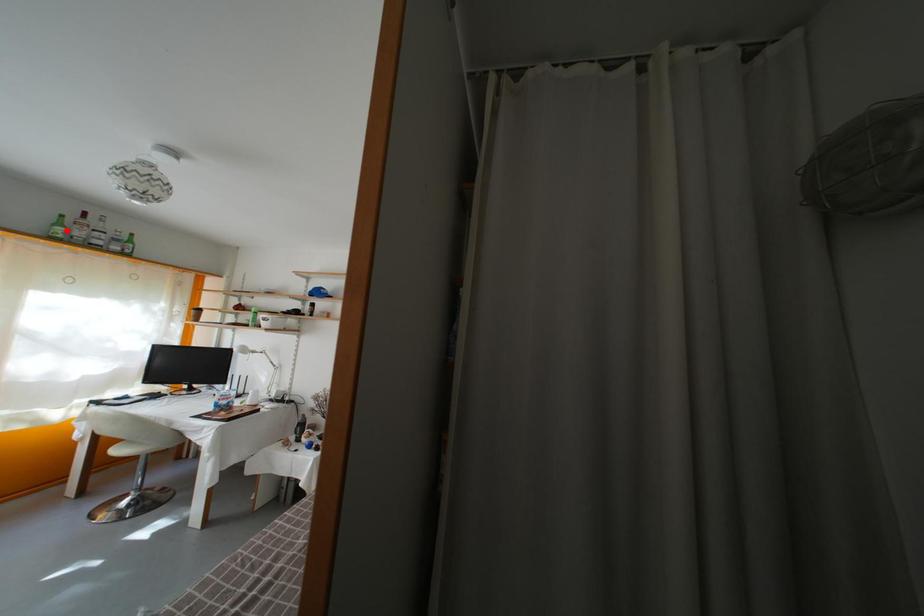
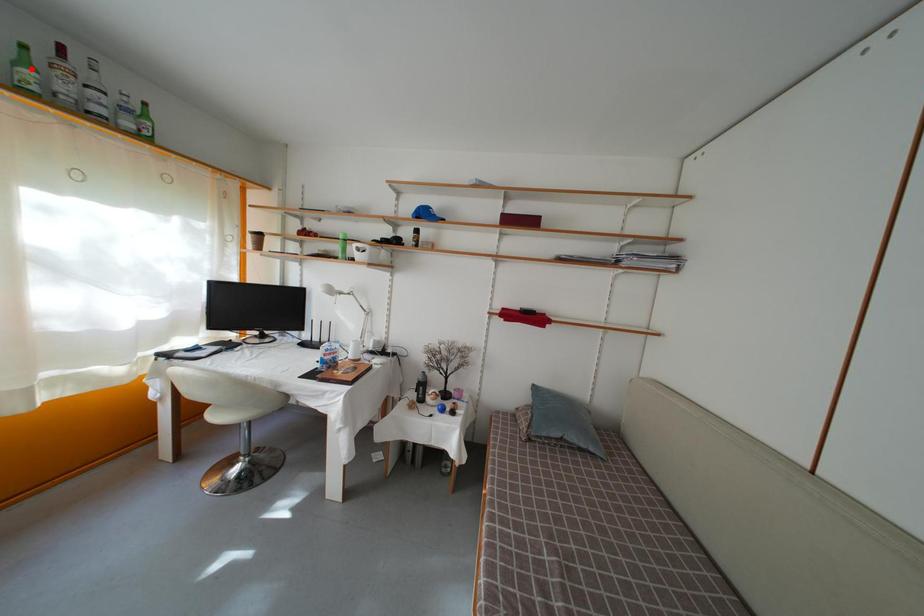
I am providing you with two images of the same scene from different viewpoints. A red point is marked on the first image and another point is marked on the second image. Is the red point in image1 aligned with the point shown in image2?

Yes